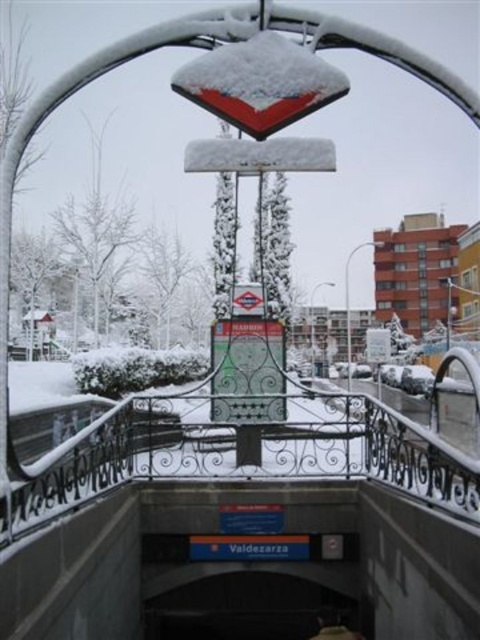
How much distance is there between metallic silver streetlamp at center and metallic lamp post at center?

14.74 feet

Which is below, metallic silver streetlamp at center or metallic lamp post at center?

metallic lamp post at center is below.

Which is in front, point (350, 358) or point (320, 282)?

Point (320, 282)

Find the location of a particular element. metallic silver streetlamp at center is located at coordinates (348, 304).